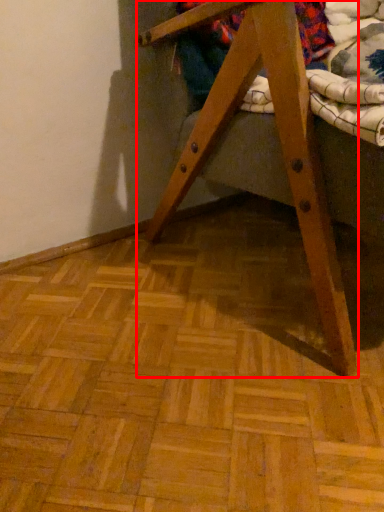
Question: From the image's perspective, where is furniture (annotated by the red box) located relative to underclothes?

Choices:
 (A) below
 (B) above

Answer: (A)